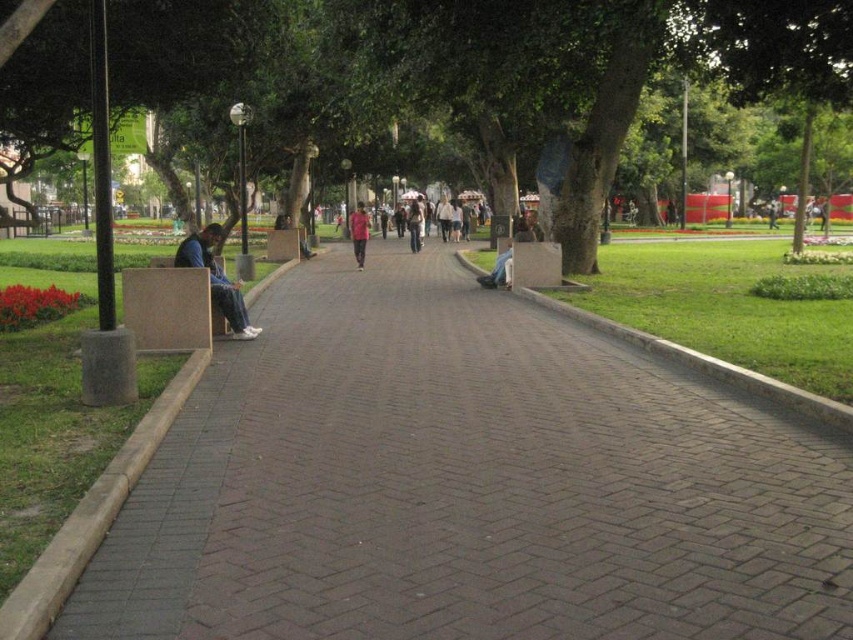
Can you confirm if dark blue jeans at left is bigger than pink fabric shirt at center?

Incorrect, dark blue jeans at left is not larger than pink fabric shirt at center.

Is dark blue jeans at left below pink fabric shirt at center?

Yes, dark blue jeans at left is below pink fabric shirt at center.

Between point (241, 296) and point (358, 218), which one is positioned in front?

Point (241, 296) is more forward.

In order to click on dark blue jeans at left in this screenshot , I will do `click(216, 278)`.

The height and width of the screenshot is (640, 853). Find the location of `green leafy tree at center`. green leafy tree at center is located at coordinates (592, 67).

Between brown brick pavement at center and green leafy tree at center, which one is positioned lower?

brown brick pavement at center is below.

Is point (374, 429) closer to camera compared to point (132, 36)?

That is True.

Where is `brown brick pavement at center`? brown brick pavement at center is located at coordinates (466, 484).